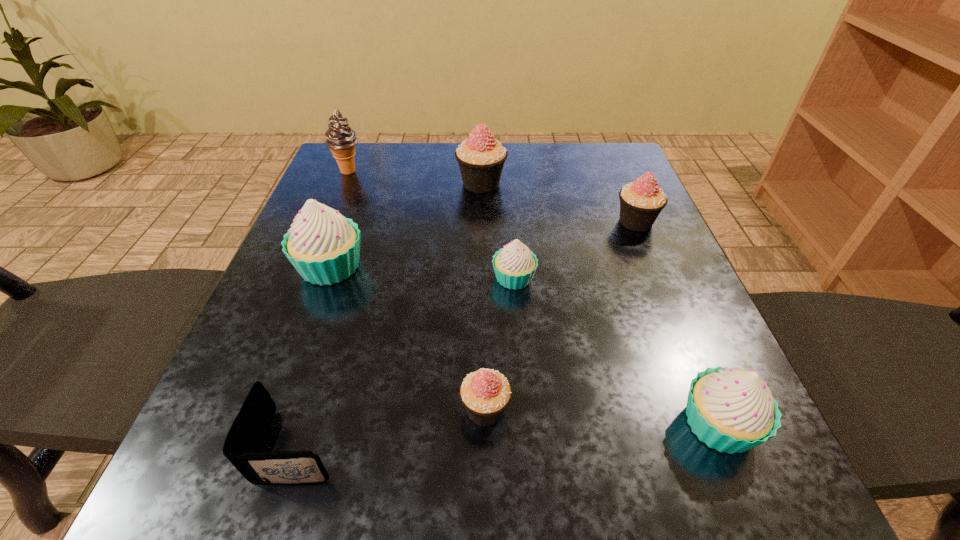
I want to click on icecream present at the far edge, so click(341, 139).

Identify the location of cupcake situated at the far edge. The image size is (960, 540). (481, 158).

Locate an element on the screen. cupcake at the near edge is located at coordinates (732, 410).

Locate an element on the screen. wallet that is at the near edge is located at coordinates (243, 442).

The image size is (960, 540). Find the location of `icecream located at the left edge`. icecream located at the left edge is located at coordinates (341, 139).

Locate an element on the screen. Image resolution: width=960 pixels, height=540 pixels. cupcake that is positioned at the left edge is located at coordinates (323, 246).

The image size is (960, 540). Identify the location of wallet that is positioned at the left edge. (243, 442).

At what (x,y) coordinates should I click in order to perform the action: click on object located at the far left corner. Please return your answer as a coordinate pair (x, y). Looking at the image, I should click on (341, 139).

Where is `object located in the near left corner section of the desktop`? object located in the near left corner section of the desktop is located at coordinates (243, 442).

Where is `object located at the near right corner`? object located at the near right corner is located at coordinates (732, 410).